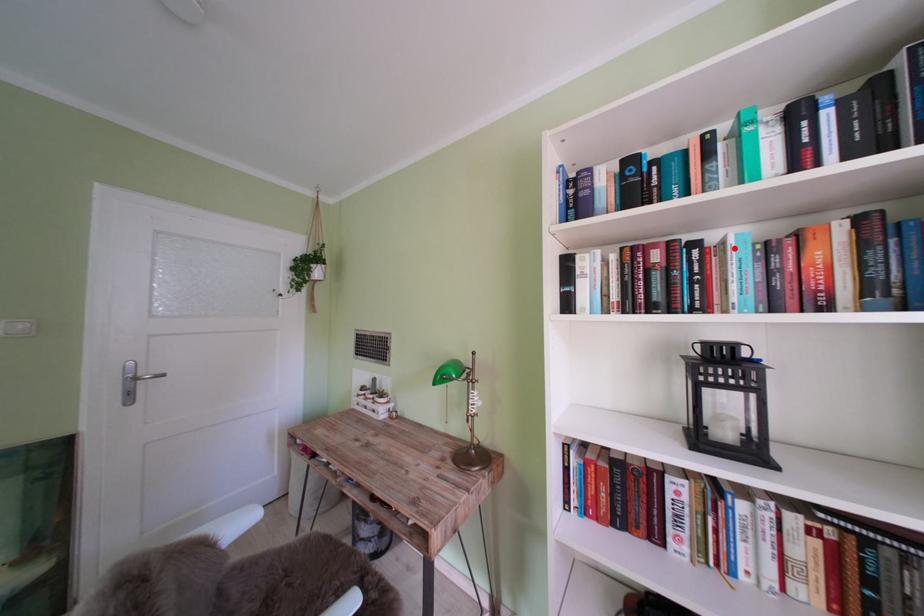
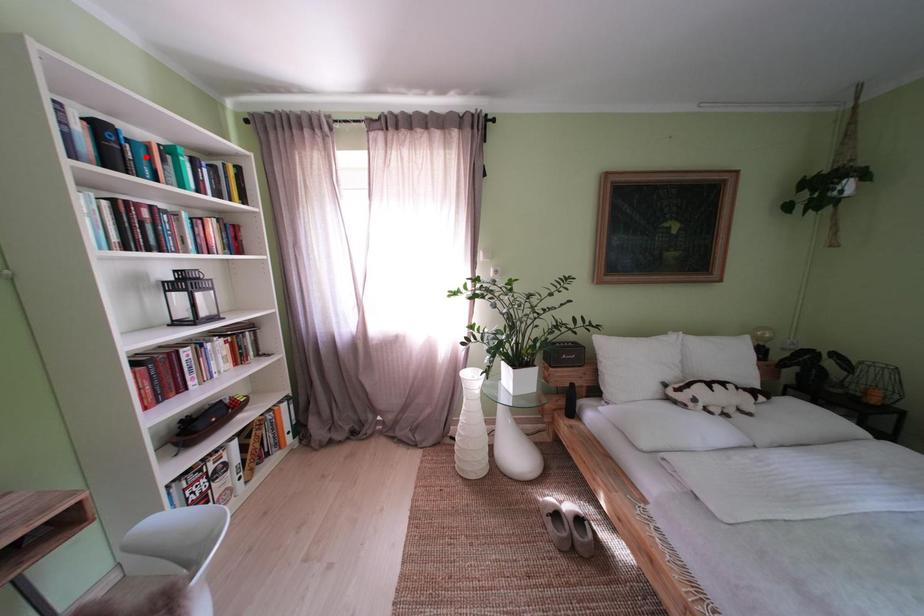
In the scene shown: I am providing you with two images of the same scene from different viewpoints. A red point is marked on the first image and another point is marked on the second image. Is the red point in image1 aligned with the point shown in image2?

No